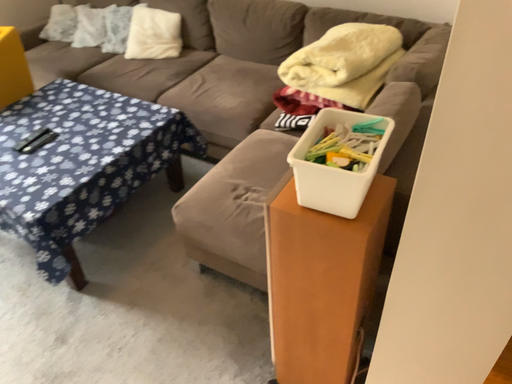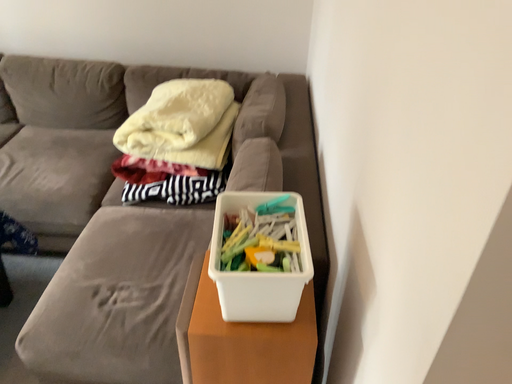
Question: How did the camera likely rotate when shooting the video?

Choices:
 (A) rotated left
 (B) rotated right

Answer: (B)